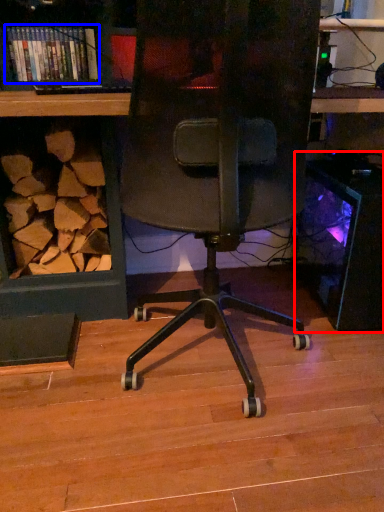
Question: Which point is further to the camera, desktop computer (highlighted by a red box) or book (highlighted by a blue box)?

Choices:
 (A) desktop computer
 (B) book

Answer: (B)